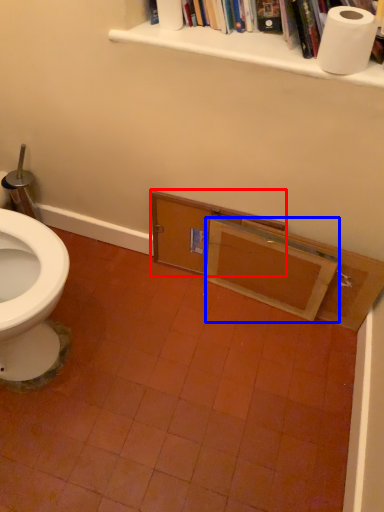
Question: Which point is further to the camera, drawer (highlighted by a red box) or drawer (highlighted by a blue box)?

Choices:
 (A) drawer
 (B) drawer

Answer: (A)